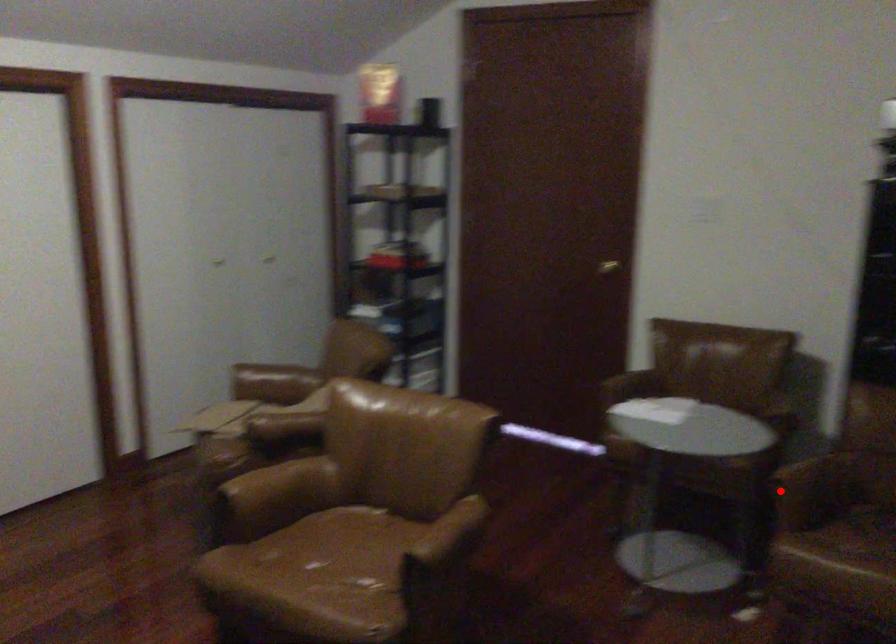
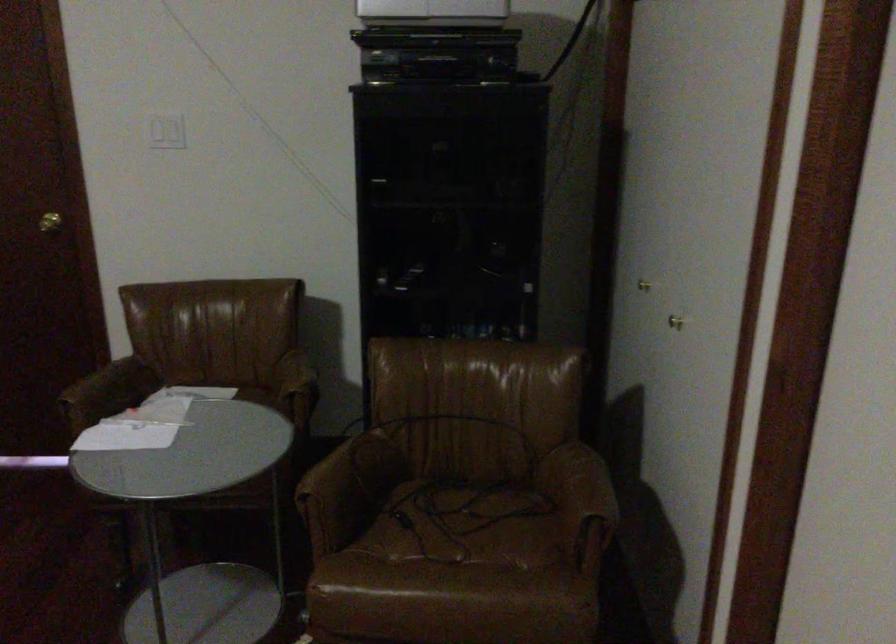
The point at the highlighted location is marked in the first image. Where is the corresponding point in the second image?

(312, 513)